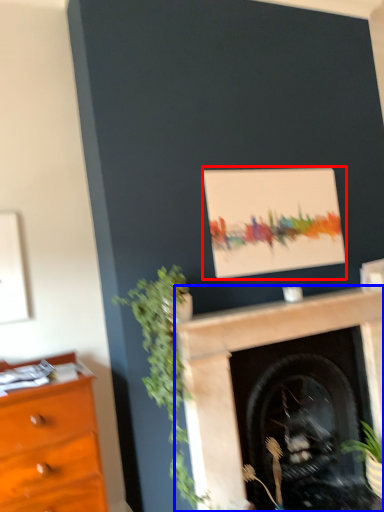
Question: Among these objects, which one is farthest to the camera, picture frame (highlighted by a red box) or fireplace (highlighted by a blue box)?

Choices:
 (A) picture frame
 (B) fireplace

Answer: (A)